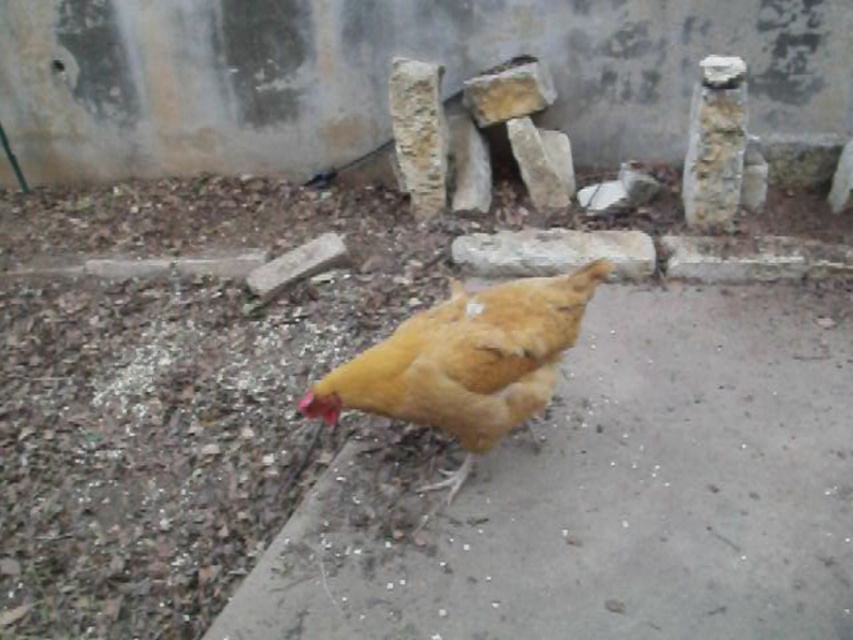
Does yellow feathered chicken at center have a lesser width compared to rough stone at center?

Incorrect, yellow feathered chicken at center's width is not less than rough stone at center's.

Can you confirm if yellow feathered chicken at center is positioned to the left of rough stone at center?

No, yellow feathered chicken at center is not to the left of rough stone at center.

Is point (606, 442) in front of point (614, 244)?

Yes, point (606, 442) is closer to viewer.

The height and width of the screenshot is (640, 853). I want to click on yellow feathered chicken at center, so click(602, 493).

Measure the distance from golden feathered chicken at center to rough stone at center.

golden feathered chicken at center and rough stone at center are 1.23 meters apart from each other.

Is point (483, 385) less distant than point (494, 257)?

Yes, point (483, 385) is in front of point (494, 257).

What do you see at coordinates (466, 362) in the screenshot? I see `golden feathered chicken at center` at bounding box center [466, 362].

I want to click on golden feathered chicken at center, so click(x=466, y=362).

Which of these two, yellow feathered chicken at center or golden feathered chicken at center, stands shorter?

Standing shorter between the two is golden feathered chicken at center.

Between point (610, 518) and point (494, 312), which one is positioned in front?

Point (494, 312)

This screenshot has height=640, width=853. In order to click on yellow feathered chicken at center in this screenshot , I will do `click(602, 493)`.